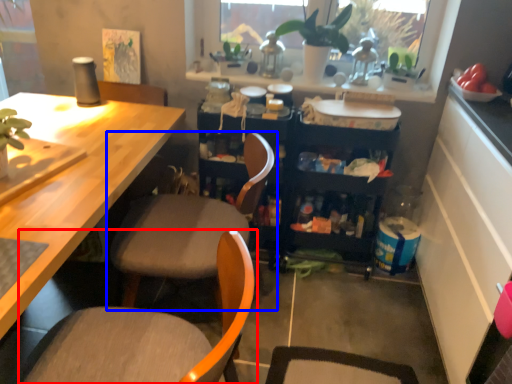
Question: Which object appears closest to the camera in this image, chair (highlighted by a red box) or chair (highlighted by a blue box)?

Choices:
 (A) chair
 (B) chair

Answer: (A)